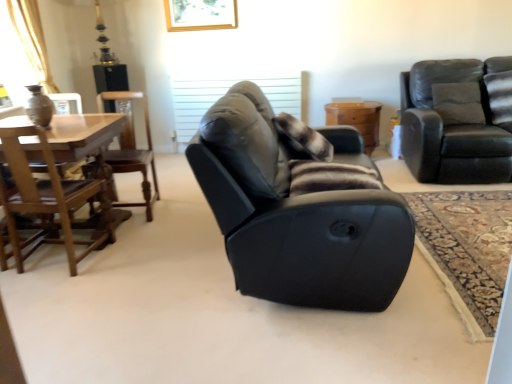
Question: Considering the relative sizes of brown fuzzy pillow at center and wooden chest at center in the image provided, is brown fuzzy pillow at center wider than wooden chest at center?

Choices:
 (A) no
 (B) yes

Answer: (B)

Question: Is brown fuzzy pillow at center to the left of wooden chest at center from the viewer's perspective?

Choices:
 (A) no
 (B) yes

Answer: (B)

Question: From a real-world perspective, is brown fuzzy pillow at center below wooden chest at center?

Choices:
 (A) yes
 (B) no

Answer: (B)

Question: Can you confirm if brown fuzzy pillow at center is shorter than wooden chest at center?

Choices:
 (A) yes
 (B) no

Answer: (B)

Question: Can you confirm if brown fuzzy pillow at center is smaller than wooden chest at center?

Choices:
 (A) yes
 (B) no

Answer: (B)

Question: Is brown fuzzy pillow at center oriented towards wooden chest at center?

Choices:
 (A) no
 (B) yes

Answer: (A)

Question: Is wooden chest at center completely or partially inside wooden chair at left, marked as the 1th chair in a left-to-right arrangement?

Choices:
 (A) yes
 (B) no

Answer: (B)

Question: Does wooden chair at left, marked as the 1th chair in a left-to-right arrangement, turn towards wooden chest at center?

Choices:
 (A) yes
 (B) no

Answer: (B)

Question: Are wooden chair at left, marked as the 1th chair in a left-to-right arrangement, and wooden chest at center beside each other?

Choices:
 (A) no
 (B) yes

Answer: (A)

Question: Is wooden chair at left, the 4th chair from the right, further to the viewer compared to wooden chest at center?

Choices:
 (A) yes
 (B) no

Answer: (B)

Question: Are wooden chair at left, marked as the 1th chair in a left-to-right arrangement, and wooden chest at center located far from each other?

Choices:
 (A) yes
 (B) no

Answer: (A)

Question: Considering the relative positions of wooden chair at left, the 4th chair from the right, and wooden chest at center in the image provided, is wooden chair at left, the 4th chair from the right, in front of wooden chest at center?

Choices:
 (A) no
 (B) yes

Answer: (B)

Question: From a real-world perspective, is brown fuzzy pillow at center located higher than wooden chair at left, placed as the second chair when sorted from left to right?

Choices:
 (A) no
 (B) yes

Answer: (B)